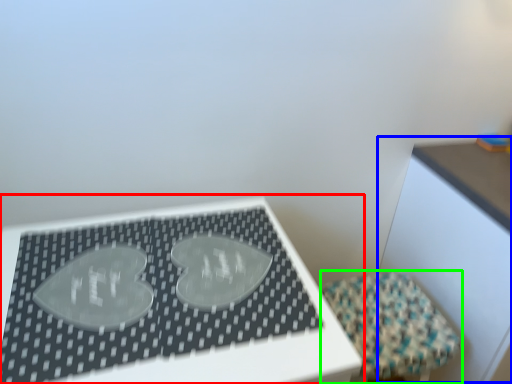
Question: Which object is the closest to the table (highlighted by a red box)? Choose among these: table (highlighted by a blue box) or furniture (highlighted by a green box).

Choices:
 (A) table
 (B) furniture

Answer: (B)